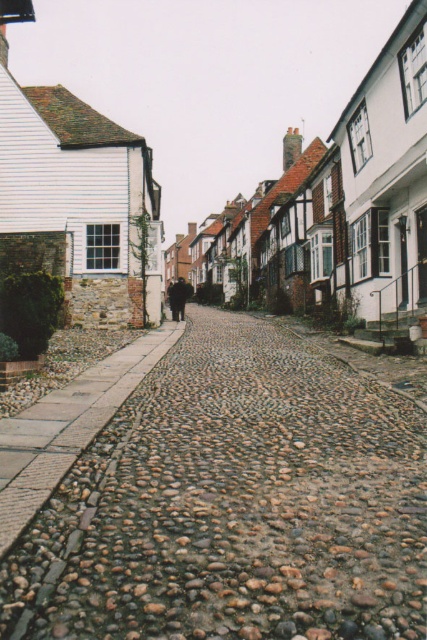
Does white wooden house at center appear on the right side of brown cobblestone path at lower left?

No, white wooden house at center is not to the right of brown cobblestone path at lower left.

Which is behind, point (222, 83) or point (9, 444)?

The point (222, 83) is more distant.

What do you see at coordinates (195, 81) in the screenshot? I see `white wooden house at center` at bounding box center [195, 81].

Locate an element on the screen. white wooden house at center is located at coordinates (195, 81).

Is point (263, 554) farther from viewer compared to point (63, 456)?

No, (263, 554) is in front of (63, 456).

You are a GUI agent. You are given a task and a screenshot of the screen. Output one action in this format:
    pyautogui.click(x=<x>, y=<y>)
    Task: Click on the brown rough cobblestone at center
    
    Given the screenshot: What is the action you would take?
    pyautogui.click(x=233, y=504)

Which is more to the left, brown rough cobblestone at center or white wooden house at center?

white wooden house at center

Is brown rough cobblestone at center below white wooden house at center?

Correct, brown rough cobblestone at center is located below white wooden house at center.

You are a GUI agent. You are given a task and a screenshot of the screen. Output one action in this format:
    pyautogui.click(x=<x>, y=<y>)
    Task: Click on the brown rough cobblestone at center
    
    Given the screenshot: What is the action you would take?
    pyautogui.click(x=233, y=504)

The image size is (427, 640). In order to click on brown rough cobblestone at center in this screenshot , I will do `click(233, 504)`.